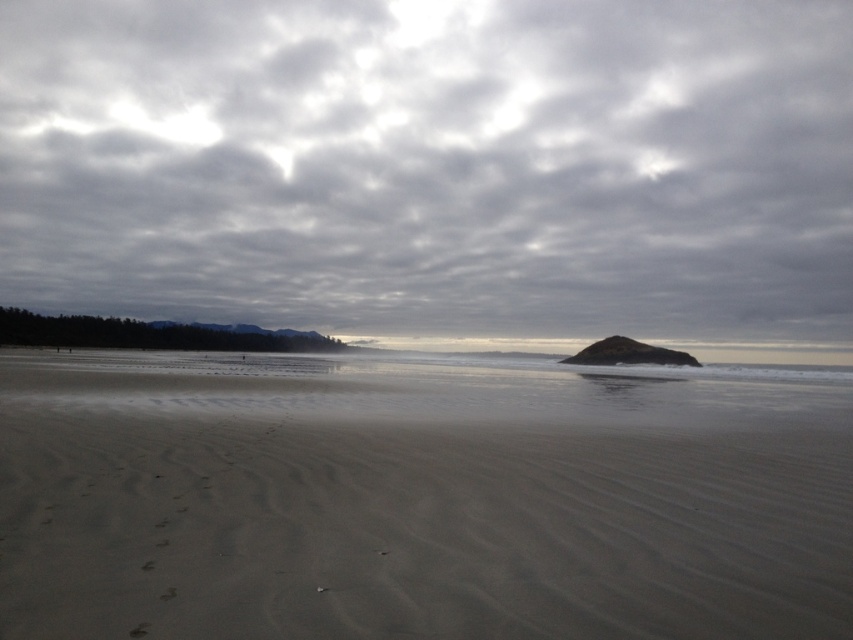
You are standing on the beach and looking at the cloudy sky at upper center and the smooth sand at center. Which object takes up more space in the image?

The cloudy sky at upper center is larger in size than the smooth sand at center, so it takes up more space in the image.

You are standing on the beach and see two points marked in the image. If you walk straight towards the point at coordinates point (833, 422), will you pass by the point at point (374, 33) first?

No, because point (374, 33) is behind point (833, 422), so you would reach point (833, 422) first without passing point (374, 33).

You are standing on the beach and looking at the cloudy sky at upper center and the smooth sand at center. Which object occupies a larger horizontal space in the image?

The cloudy sky at upper center is wider than the smooth sand at center according to the description.